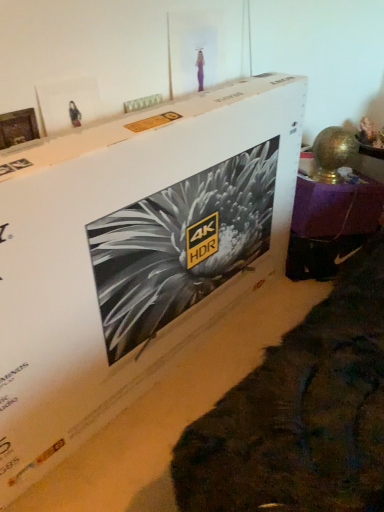
Question: Would you say wooden photo frame at upper left is to the left or to the right of white cardboard box at center in the picture?

Choices:
 (A) right
 (B) left

Answer: (B)

Question: Choose the correct answer: Is wooden photo frame at upper left inside white cardboard box at center or outside it?

Choices:
 (A) inside
 (B) outside

Answer: (B)

Question: Considering the real-world distances, which object is closest to the wooden photo frame at upper left?

Choices:
 (A) white cardboard box at center
 (B) metallic gold lamp at right

Answer: (A)

Question: Which of these objects is positioned farthest from the white cardboard box at center?

Choices:
 (A) wooden photo frame at upper left
 (B) metallic gold lamp at right

Answer: (B)